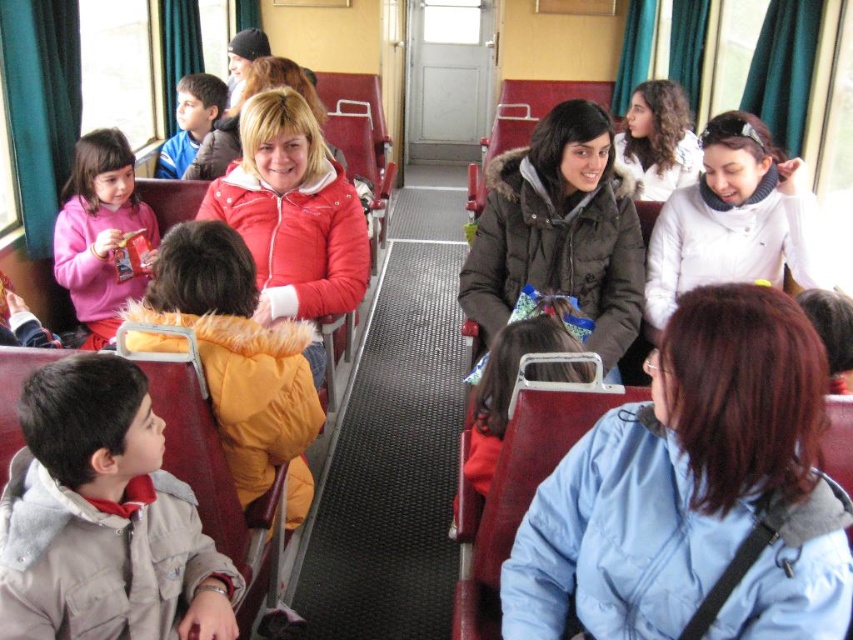
Is light gray fleece jacket at lower left thinner than white fleece sweater at upper right?

Yes, light gray fleece jacket at lower left is thinner than white fleece sweater at upper right.

Is point (20, 458) closer to camera compared to point (723, 241)?

Yes, point (20, 458) is closer to viewer.

Is point (117, 374) closer to camera compared to point (700, 180)?

Yes, it is.

At what (x,y) coordinates should I click in order to perform the action: click on light gray fleece jacket at lower left. Please return your answer as a coordinate pair (x, y). Looking at the image, I should click on (103, 518).

Is fuzzy yellow jacket at center taller than curly hair at upper right?

Correct, fuzzy yellow jacket at center is much taller as curly hair at upper right.

Which of these two, fuzzy yellow jacket at center or curly hair at upper right, stands taller?

fuzzy yellow jacket at center

Is point (260, 490) positioned before point (674, 108)?

Yes.

Where is `fuzzy yellow jacket at center`? The height and width of the screenshot is (640, 853). fuzzy yellow jacket at center is located at coordinates (241, 358).

From the picture: Can you confirm if light gray fleece jacket at lower left is positioned to the right of dark brown puffy coat at center?

In fact, light gray fleece jacket at lower left is to the left of dark brown puffy coat at center.

Is light gray fleece jacket at lower left closer to camera compared to dark brown puffy coat at center?

Yes, light gray fleece jacket at lower left is closer to the viewer.

Between point (33, 440) and point (590, 204), which one is positioned in front?

Point (33, 440) is in front.

The image size is (853, 640). I want to click on light gray fleece jacket at lower left, so click(103, 518).